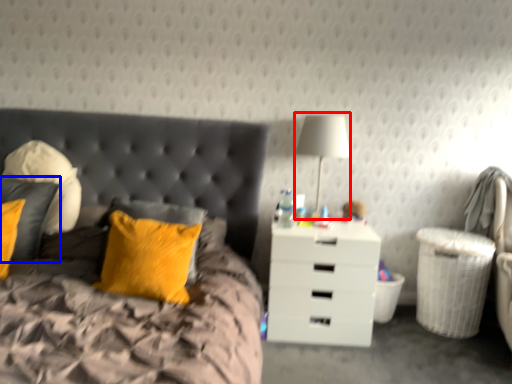
Question: Which object appears farthest to the camera in this image, bedside lamp (highlighted by a red box) or pillow (highlighted by a blue box)?

Choices:
 (A) bedside lamp
 (B) pillow

Answer: (A)